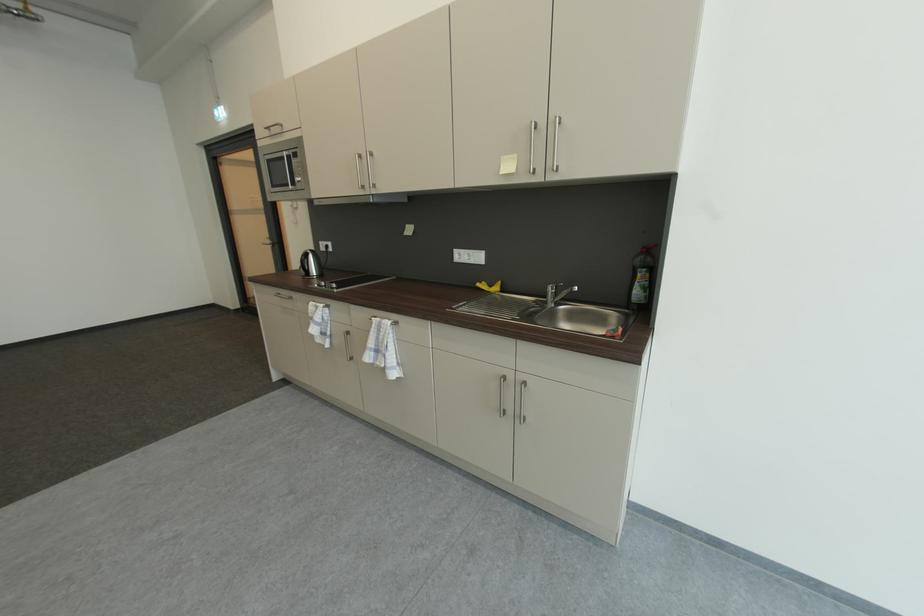
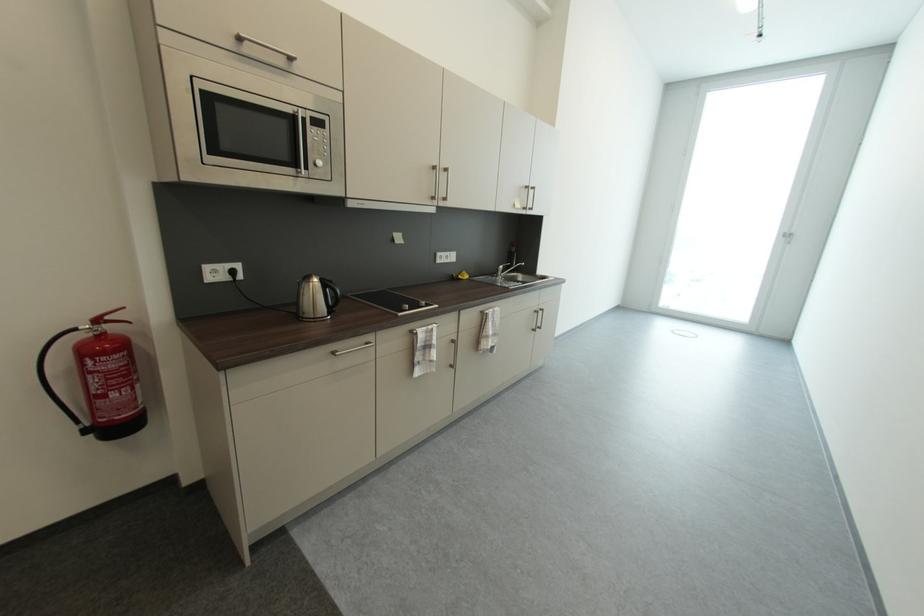
The point at (506, 175) is marked in the first image. Where is the corresponding point in the second image?

(523, 209)